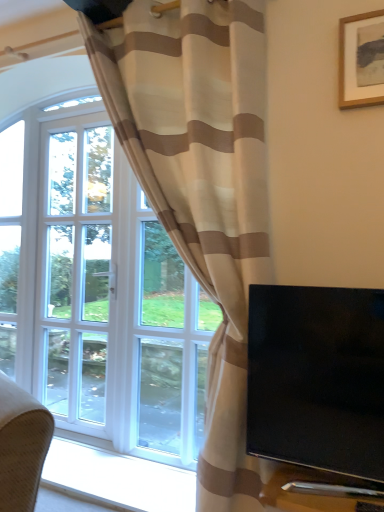
Question: Is wooden picture frame at upper right smaller than white glass screen door at left?

Choices:
 (A) yes
 (B) no

Answer: (A)

Question: From the image's perspective, does wooden picture frame at upper right appear lower than white glass screen door at left?

Choices:
 (A) no
 (B) yes

Answer: (A)

Question: Can you confirm if wooden picture frame at upper right is taller than white glass screen door at left?

Choices:
 (A) yes
 (B) no

Answer: (B)

Question: Is wooden picture frame at upper right surrounding white glass screen door at left?

Choices:
 (A) yes
 (B) no

Answer: (B)

Question: From the image's perspective, is wooden picture frame at upper right above white glass screen door at left?

Choices:
 (A) yes
 (B) no

Answer: (A)

Question: Considering the positions of wooden picture frame at upper right and black glossy tv at right in the image, is wooden picture frame at upper right wider or thinner than black glossy tv at right?

Choices:
 (A) wide
 (B) thin

Answer: (B)

Question: Is point (372, 12) closer or farther from the camera than point (286, 287)?

Choices:
 (A) farther
 (B) closer

Answer: (A)

Question: From the image's perspective, is wooden picture frame at upper right positioned above or below black glossy tv at right?

Choices:
 (A) above
 (B) below

Answer: (A)

Question: Is wooden picture frame at upper right in front of or behind black glossy tv at right in the image?

Choices:
 (A) behind
 (B) front

Answer: (A)

Question: Considering their positions, is white glass screen door at left located in front of or behind beige striped curtain at left?

Choices:
 (A) behind
 (B) front

Answer: (A)

Question: Considering the positions of white glass screen door at left and beige striped curtain at left in the image, is white glass screen door at left taller or shorter than beige striped curtain at left?

Choices:
 (A) tall
 (B) short

Answer: (B)

Question: From a real-world perspective, is white glass screen door at left physically located above or below beige striped curtain at left?

Choices:
 (A) below
 (B) above

Answer: (A)

Question: Is white glass screen door at left situated inside beige striped curtain at left or outside?

Choices:
 (A) outside
 (B) inside

Answer: (A)

Question: From the image's perspective, is wooden picture frame at upper right positioned above or below white glass screen door at left?

Choices:
 (A) below
 (B) above

Answer: (B)

Question: Is wooden picture frame at upper right wider or thinner than white glass screen door at left?

Choices:
 (A) wide
 (B) thin

Answer: (B)